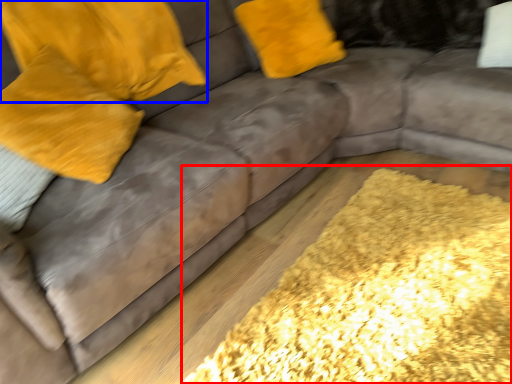
Question: Which object appears farthest to the camera in this image, mat (highlighted by a red box) or pillow (highlighted by a blue box)?

Choices:
 (A) mat
 (B) pillow

Answer: (B)